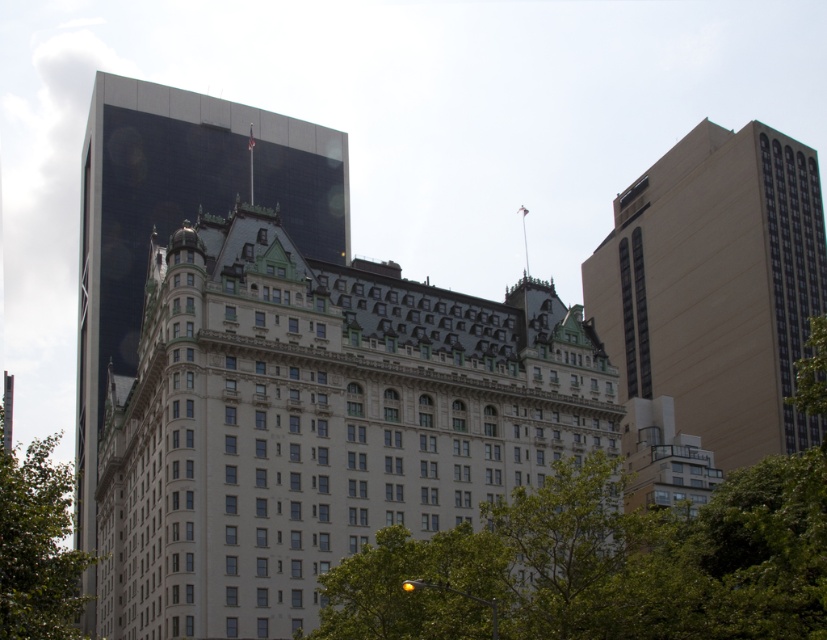
You are a city planner assessing green spaces in the area. You notice two green leafy trees in the image. Which tree, the green leafy tree at center or the green leafy tree at lower left, is the smaller one?

The green leafy tree at center has a smaller size compared to the green leafy tree at lower left, so the smaller one is the green leafy tree at center.